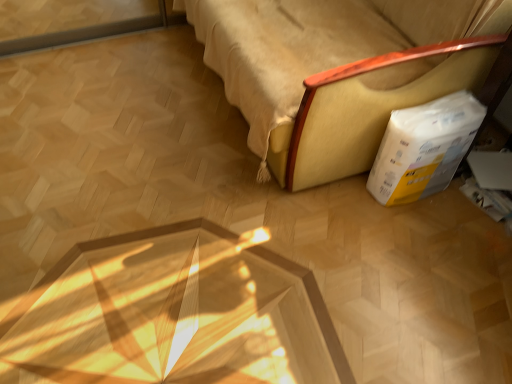
Question: Based on their sizes in the image, would you say yellow fabric sofa at lower right is bigger or smaller than white/yellow cardboard box at lower right?

Choices:
 (A) big
 (B) small

Answer: (A)

Question: From the image's perspective, is yellow fabric sofa at lower right above or below white/yellow cardboard box at lower right?

Choices:
 (A) below
 (B) above

Answer: (B)

Question: Does point (361, 64) appear closer or farther from the camera than point (444, 109)?

Choices:
 (A) farther
 (B) closer

Answer: (B)

Question: Based on their sizes in the image, would you say white/yellow cardboard box at lower right is bigger or smaller than yellow fabric sofa at lower right?

Choices:
 (A) small
 (B) big

Answer: (A)

Question: From a real-world perspective, relative to yellow fabric sofa at lower right, is white/yellow cardboard box at lower right vertically above or below?

Choices:
 (A) below
 (B) above

Answer: (A)

Question: Relative to yellow fabric sofa at lower right, is white/yellow cardboard box at lower right in front or behind?

Choices:
 (A) front
 (B) behind

Answer: (B)

Question: From the image's perspective, relative to yellow fabric sofa at lower right, is white/yellow cardboard box at lower right above or below?

Choices:
 (A) below
 (B) above

Answer: (A)